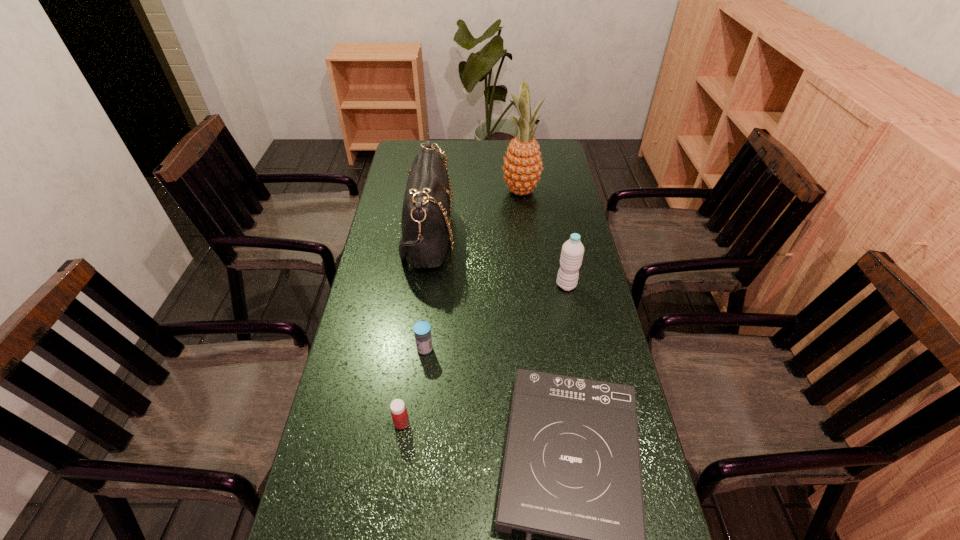
Identify the location of unoccupied area between the second tallest object and the pineapple. This screenshot has height=540, width=960. (474, 213).

Find the location of a particular element. The image size is (960, 540). free space between the fourth farthest object and the tallest object is located at coordinates (473, 269).

Where is `empty location between the nearer medicine and the water bottle`? The height and width of the screenshot is (540, 960). empty location between the nearer medicine and the water bottle is located at coordinates (484, 354).

The width and height of the screenshot is (960, 540). In order to click on blank region between the water bottle and the nearer medicine in this screenshot , I will do `click(484, 354)`.

The image size is (960, 540). In order to click on free space between the nearer medicine and the fourth farthest object in this screenshot , I will do `click(414, 386)`.

Select which object is the second closest to the handbag. Please provide its 2D coordinates. Your answer should be formatted as a tuple, i.e. [(x, y)], where the tuple contains the x and y coordinates of a point satisfying the conditions above.

[(422, 330)]

The height and width of the screenshot is (540, 960). Find the location of `the fourth closest object relative to the water bottle`. the fourth closest object relative to the water bottle is located at coordinates (422, 330).

What are the coordinates of `vacant space that satisfies the following two spatial constraints: 1. at the front of the handbag with chain and zipper; 2. on the right side of the water bottle` in the screenshot? It's located at (421, 285).

What are the coordinates of `free space that satisfies the following two spatial constraints: 1. on the back side of the pineapple; 2. on the right side of the farther medicine` in the screenshot? It's located at (442, 190).

Identify the location of free spot that satisfies the following two spatial constraints: 1. on the front side of the tallest object; 2. at the front of the handbag with chain and zipper. (526, 236).